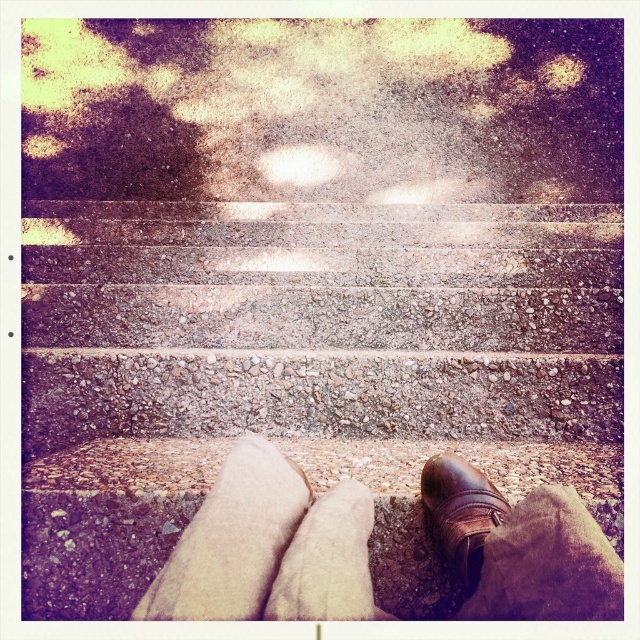
You are a drone operator trying to capture a photo of the concrete textured stairs at center from above. The camera is currently positioned at point 0.5, 0.5. To center the stairs in the photo, should you move the camera slightly to the right or left? Please explain your reasoning based on the stairs location.

The concrete textured stairs at center are located at point [305,371]. Since the camera is at [320,320], the stairs are slightly to the right and down from the current position. To center them, move the camera slightly to the right and down.

You are a photographer trying to capture the best angle of the beige wool sock at lower center and the brown leather shoe at lower center. Since you want to highlight both items clearly, which object should you focus on first if you need to adjust your camera focus from the closest to the farthest point?

The beige wool sock at lower center is closer to the camera than the brown leather shoe at lower center, so you should focus on the beige wool sock at lower center first before adjusting to the brown leather shoe at lower center.